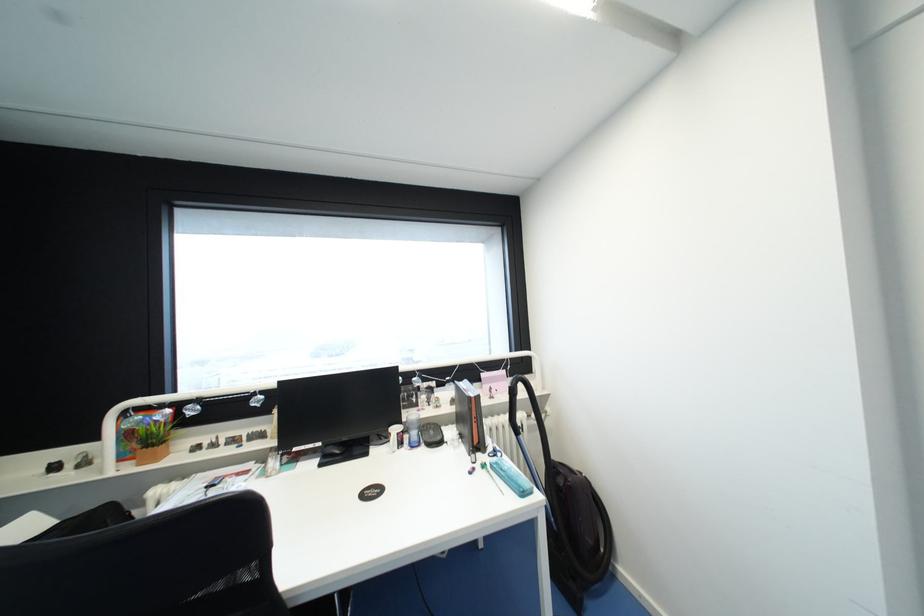
Locate an element on the screen. vertical black device is located at coordinates (337, 411).